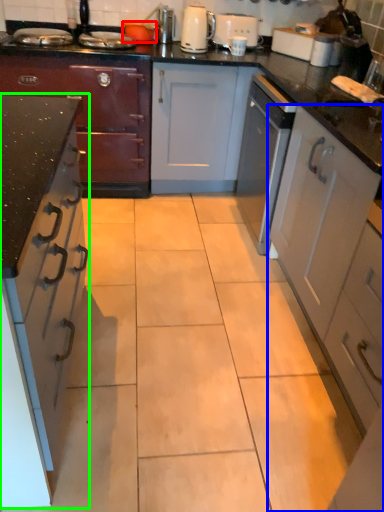
Question: Which object is positioned closest to appliance (highlighted by a red box)? Select from cabinetry (highlighted by a blue box) and cabinetry (highlighted by a green box).

Choices:
 (A) cabinetry
 (B) cabinetry

Answer: (A)